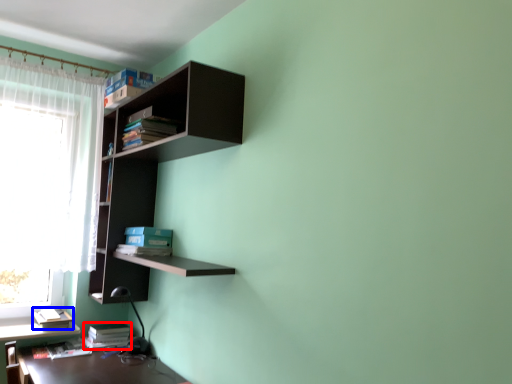
Question: Which of the following is the closest to the observer, book (highlighted by a red box) or book (highlighted by a blue box)?

Choices:
 (A) book
 (B) book

Answer: (B)